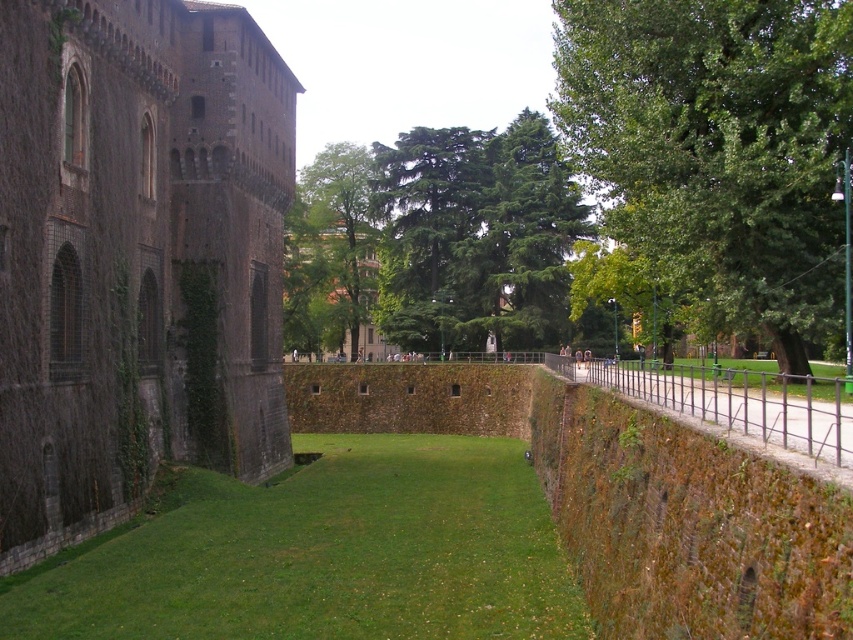
You are planning to set up a picnic area in the park near the historic stone building. You have two spots in mind, one at the center with green grass at center and another at the right with green grass at right. Which area has a larger space for your picnic setup?

The green grass at right has a larger space than the green grass at center, so the picnic area at the right would be more suitable for a larger setup.

You are a drone operator tasked with capturing aerial footage of the historic stone building. Your drone has a maximum flight range of 40 meters. If you are standing at the camera position, can your drone reach the dark stone wall at left without exceeding its range?

The dark stone wall at left is 38.43 meters from camera, so yes, the drone can reach it since the distance is within the 40 meter range.